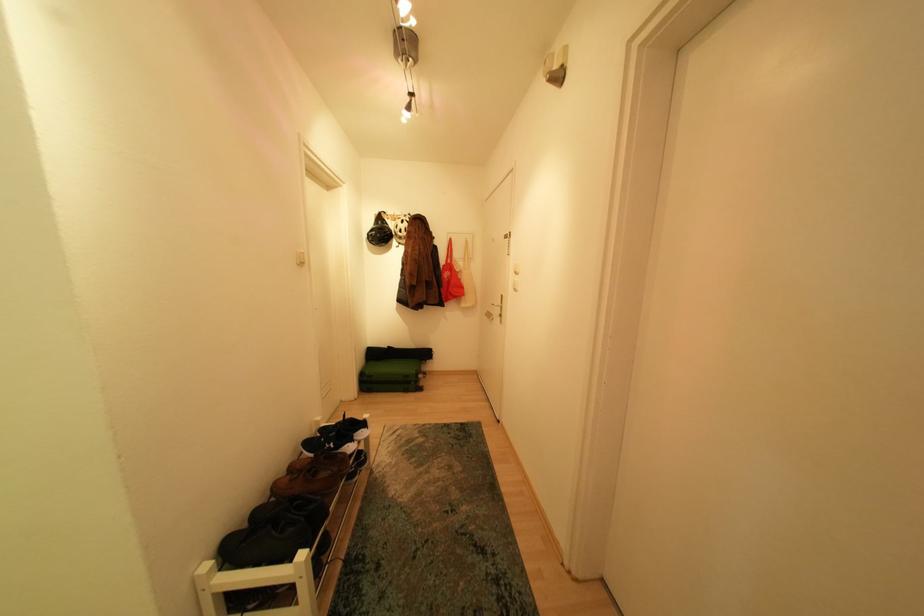
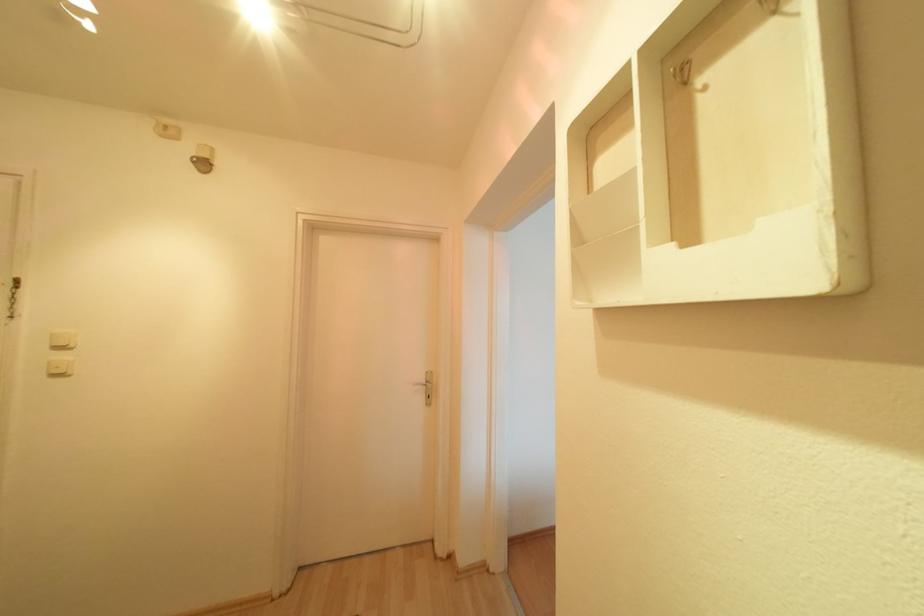
Find the pixel in the second image that matches (x=523, y=280) in the first image.

(67, 358)